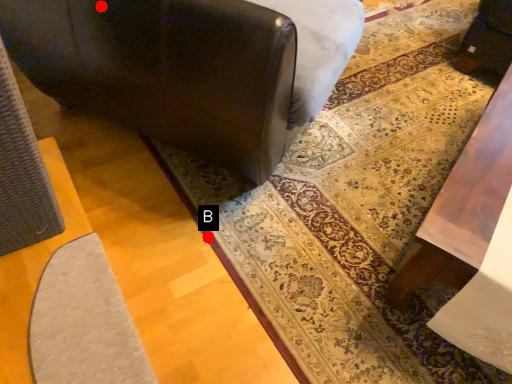
Question: Two points are circled on the image, labeled by A and B beside each circle. Which point appears farthest from the camera in this image?

Choices:
 (A) A is further
 (B) B is further

Answer: (B)